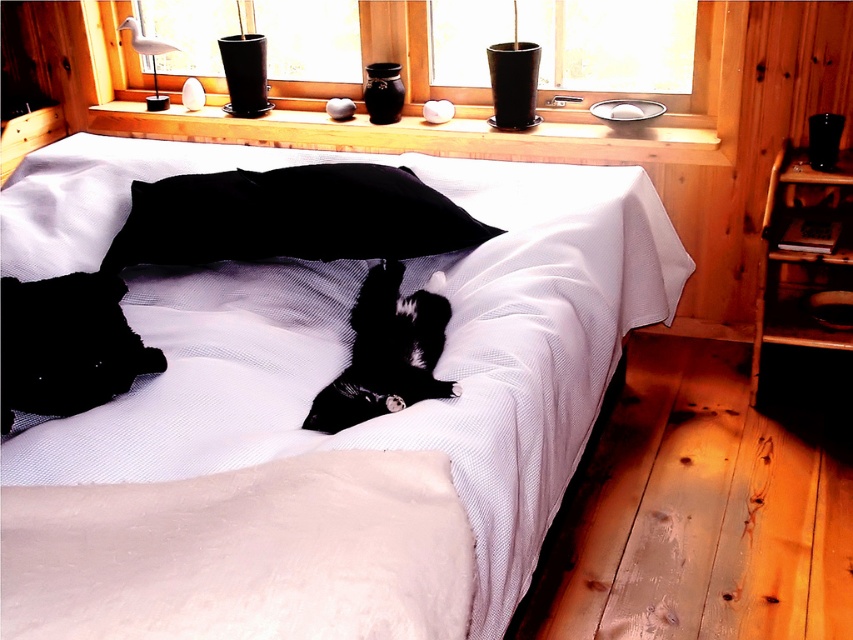
Which of these two, white textured bed at center or black matte pillow at center, stands shorter?

black matte pillow at center is shorter.

Which is above, white textured bed at center or black matte pillow at center?

Positioned higher is black matte pillow at center.

The width and height of the screenshot is (853, 640). Describe the element at coordinates (350, 333) in the screenshot. I see `white textured bed at center` at that location.

Where is `white textured bed at center`? This screenshot has width=853, height=640. white textured bed at center is located at coordinates (350, 333).

Between black matte pillow at center and smooth glass window at center, which one is positioned higher?

smooth glass window at center

Is black matte pillow at center positioned before smooth glass window at center?

Yes.

At what (x,y) coordinates should I click in order to perform the action: click on black matte pillow at center. Please return your answer as a coordinate pair (x, y). This screenshot has height=640, width=853. Looking at the image, I should click on (289, 218).

Where is `black matte pillow at center`? black matte pillow at center is located at coordinates (289, 218).

Who is more distant from viewer, (509, 474) or (717, 54)?

Positioned behind is point (717, 54).

The height and width of the screenshot is (640, 853). In order to click on white textured bed at center in this screenshot , I will do `click(350, 333)`.